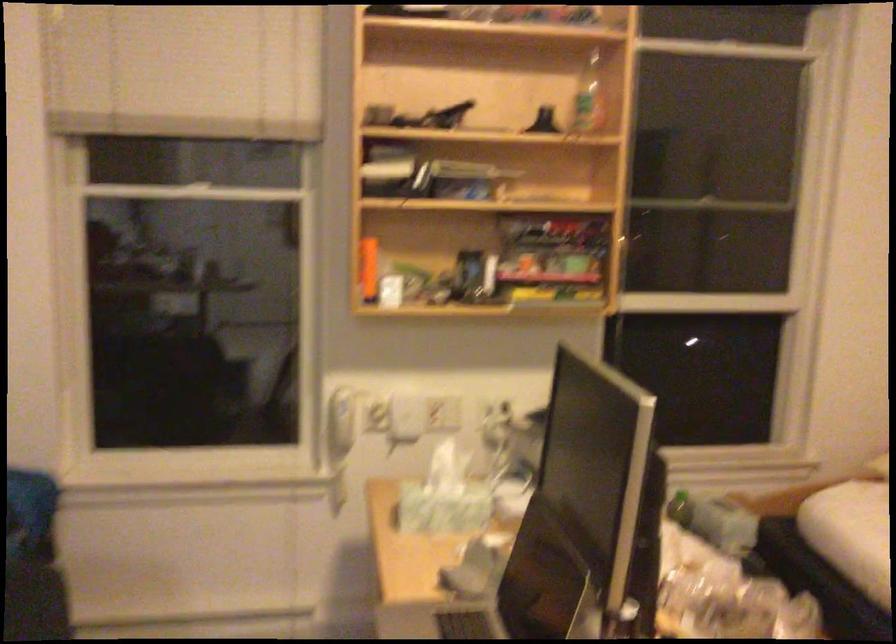
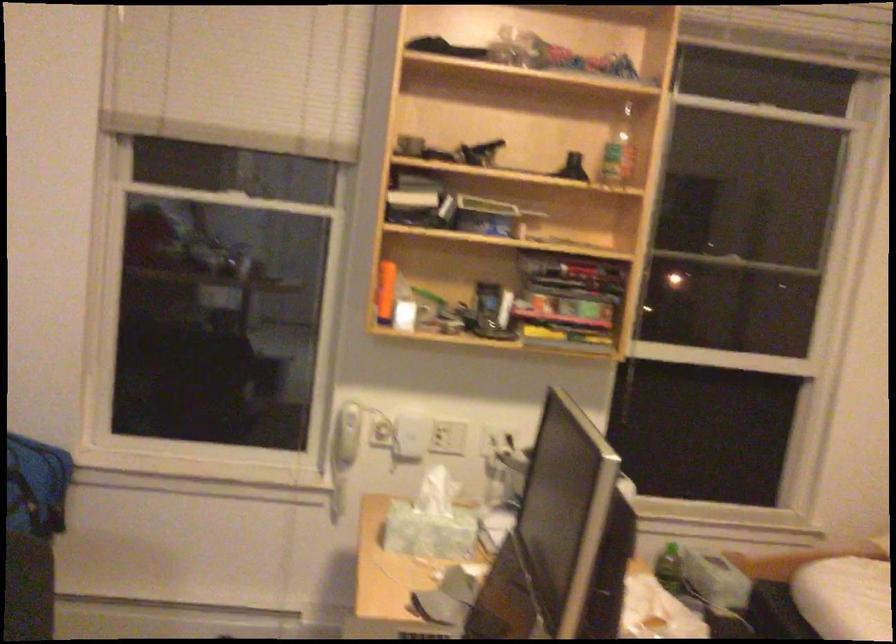
Locate, in the second image, the point that corresponds to the point at 341,404 in the first image.

(349, 418)